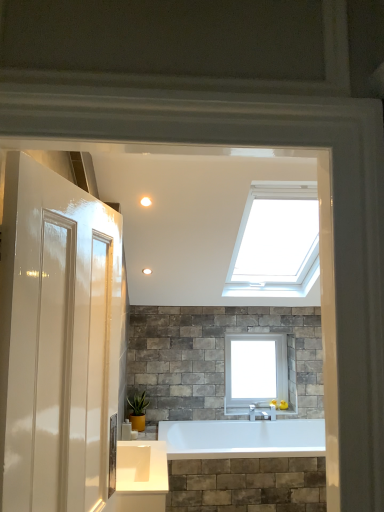
This screenshot has height=512, width=384. What do you see at coordinates (138, 404) in the screenshot?
I see `green matte plant at lower center` at bounding box center [138, 404].

Where is `matte white light fixture at upper center`? Image resolution: width=384 pixels, height=512 pixels. matte white light fixture at upper center is located at coordinates (146, 201).

Considering the positions of points (141, 203) and (236, 372), is point (141, 203) closer to camera compared to point (236, 372)?

Yes, it is.

Looking at this image, is matte white light fixture at upper center wider than white glass window at upper center?

Incorrect, the width of matte white light fixture at upper center does not surpass that of white glass window at upper center.

From a real-world perspective, is matte white light fixture at upper center on top of white glass window at upper center?

Yes.

Which is behind, matte white light fixture at upper center or white glass window at upper center?

white glass window at upper center.

Is matte white light fixture at upper center completely or partially inside green matte plant at lower center?

Actually, matte white light fixture at upper center is outside green matte plant at lower center.

Is matte white light fixture at upper center at the back of green matte plant at lower center?

No, green matte plant at lower center is not facing the opposite direction of matte white light fixture at upper center.

From the image's perspective, is green matte plant at lower center on top of matte white light fixture at upper center?

No, from the image's perspective, green matte plant at lower center is not on top of matte white light fixture at upper center.

Relative to matte white light fixture at upper center, is green matte plant at lower center in front or behind?

green matte plant at lower center is positioned farther from the viewer than matte white light fixture at upper center.

Which is behind, white glass window at upper center or green matte plant at lower center?

white glass window at upper center is more distant.

Considering the relative sizes of white glass window at upper center and green matte plant at lower center in the image provided, is white glass window at upper center shorter than green matte plant at lower center?

No, white glass window at upper center is not shorter than green matte plant at lower center.

Locate an element on the screen. The image size is (384, 512). plant below the white glass window at upper center (from the image's perspective) is located at coordinates (138, 404).

Does point (237, 409) appear closer or farther from the camera than point (140, 406)?

Point (237, 409) appears to be farther away from the viewer than point (140, 406).

From a real-world perspective, which is physically below, white glass window at upper center or matte white light fixture at upper center?

white glass window at upper center is physically lower.

Who is bigger, white glass window at upper center or matte white light fixture at upper center?

white glass window at upper center is bigger.

From the image's perspective, is white glass window at upper center located above or below matte white light fixture at upper center?

From the image's perspective, white glass window at upper center appears below matte white light fixture at upper center.

Considering the sizes of objects white glass window at upper center and matte white light fixture at upper center in the image provided, who is wider, white glass window at upper center or matte white light fixture at upper center?

white glass window at upper center is wider.

Which object is further away from the camera taking this photo, green matte plant at lower center or white glass window at upper center?

white glass window at upper center is behind.

Who is smaller, green matte plant at lower center or white glass window at upper center?

Smaller between the two is green matte plant at lower center.

Is green matte plant at lower center taller or shorter than white glass window at upper center?

green matte plant at lower center is shorter than white glass window at upper center.

Is matte white light fixture at upper center in front of green matte plant at lower center?

Yes, matte white light fixture at upper center is in front of green matte plant at lower center.

This screenshot has width=384, height=512. I want to click on lighting above the green matte plant at lower center (from a real-world perspective), so pyautogui.click(x=146, y=201).

Which of these two, matte white light fixture at upper center or green matte plant at lower center, is wider?

With larger width is green matte plant at lower center.

Is matte white light fixture at upper center next to green matte plant at lower center and touching it?

No, matte white light fixture at upper center is not making contact with green matte plant at lower center.

Where is `window behind the matte white light fixture at upper center`? Image resolution: width=384 pixels, height=512 pixels. window behind the matte white light fixture at upper center is located at coordinates (259, 373).

Identify the location of lighting that is on the right side of green matte plant at lower center. (146, 201).

From the image, which object appears to be farther from green matte plant at lower center, white glass window at upper center or matte white light fixture at upper center?

matte white light fixture at upper center is further to green matte plant at lower center.

Consider the image. From the image, which object appears to be farther from matte white light fixture at upper center, green matte plant at lower center or white glass window at upper center?

The object further to matte white light fixture at upper center is white glass window at upper center.

Based on the photo, looking at the image, which one is located closer to matte white light fixture at upper center, white glass window at upper center or green matte plant at lower center?

green matte plant at lower center is closer to matte white light fixture at upper center.

Based on their spatial positions, is green matte plant at lower center or matte white light fixture at upper center further from white glass window at upper center?

Based on the image, matte white light fixture at upper center appears to be further to white glass window at upper center.

Based on their spatial positions, is matte white light fixture at upper center or green matte plant at lower center further from white glass window at upper center?

matte white light fixture at upper center lies further to white glass window at upper center than the other object.

When comparing their distances from green matte plant at lower center, does matte white light fixture at upper center or white glass window at upper center seem further?

matte white light fixture at upper center lies further to green matte plant at lower center than the other object.

Find the location of `window between matte white light fixture at upper center and green matte plant at lower center in the vertical direction`. window between matte white light fixture at upper center and green matte plant at lower center in the vertical direction is located at coordinates (259, 373).